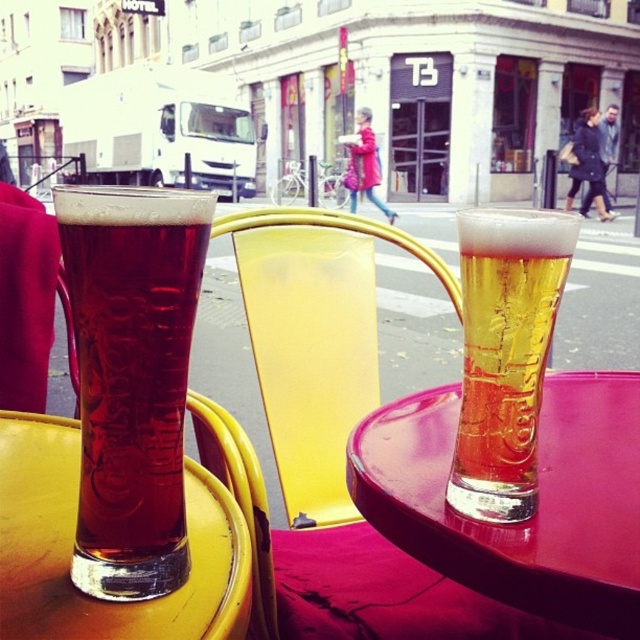
You are a customer at the outdoor cafe and want to grab both items located at point (x=444, y=397) and point (x=128, y=604). Which point should you reach first to pick up the items in order from closest to farthest?

You should reach point (x=444, y=397) first because it is closer to you than point (x=128, y=604), which is further away.

You are a customer sitting at the yellow plastic chair at center in the outdoor cafe. You want to reach for the dark amber glass at left. Is it within your immediate reach without moving your chair?

The dark amber glass at left is located above the yellow plastic chair at center, which suggests it is placed on the table. Since tables are typically at a reachable height for seated customers, you can likely reach the dark amber glass at left without moving your chair.

You are a bartender who needs to place a coaster under the translucent glass beer at center and the translucent glass at lower left. Which glass requires a larger coaster to cover its base completely?

The translucent glass beer at center requires a larger coaster because it might be wider than the translucent glass at lower left.